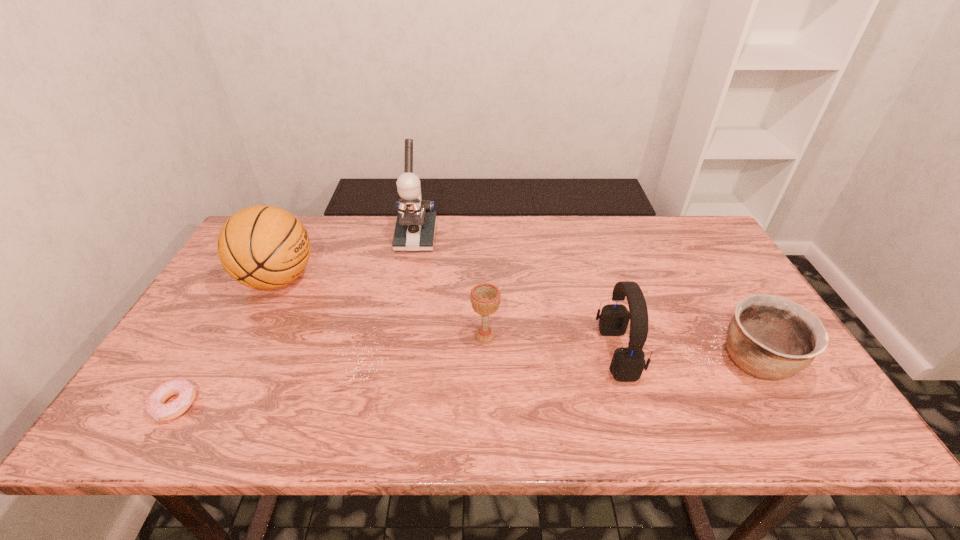
Locate an element on the screen. The height and width of the screenshot is (540, 960). free space that satisfies the following two spatial constraints: 1. on the back side of the pottery; 2. on the headband of the second object from right to left is located at coordinates (751, 353).

I want to click on vacant space that satisfies the following two spatial constraints: 1. on the surface of the basketball near the brand logo; 2. on the right side of the third object from right to left, so click(x=249, y=336).

Identify the location of vacant space that satisfies the following two spatial constraints: 1. at the eyepiece of the tallest object; 2. on the left side of the fourth object from left to right. The height and width of the screenshot is (540, 960). (397, 336).

The image size is (960, 540). Find the location of `free point that satisfies the following two spatial constraints: 1. at the eyepiece of the third object from left to right; 2. on the surface of the second farthest object near the brand logo`. free point that satisfies the following two spatial constraints: 1. at the eyepiece of the third object from left to right; 2. on the surface of the second farthest object near the brand logo is located at coordinates (408, 279).

This screenshot has width=960, height=540. Identify the location of vacant space that satisfies the following two spatial constraints: 1. at the eyepiece of the third object from left to right; 2. on the surface of the basketball near the brand logo. (408, 279).

Locate an element on the screen. The width and height of the screenshot is (960, 540). vacant area that satisfies the following two spatial constraints: 1. on the surface of the fifth nearest object near the brand logo; 2. on the back side of the third object from right to left is located at coordinates tap(249, 336).